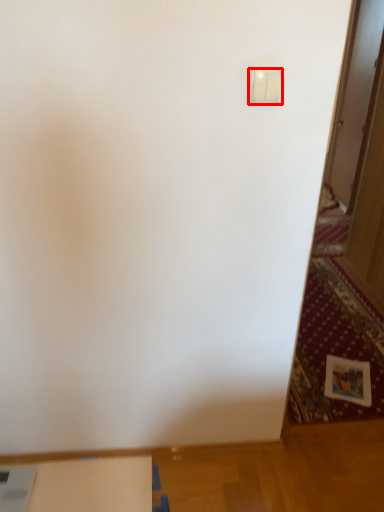
Question: From the image's perspective, considering the relative positions of light switch (annotated by the red box) and table in the image provided, where is light switch (annotated by the red box) located with respect to the staircase?

Choices:
 (A) above
 (B) below

Answer: (A)